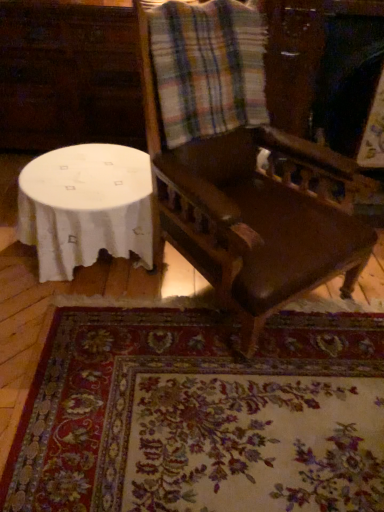
In order to click on vacant space to the left of dark brown wood chair at center in this screenshot , I will do `click(92, 318)`.